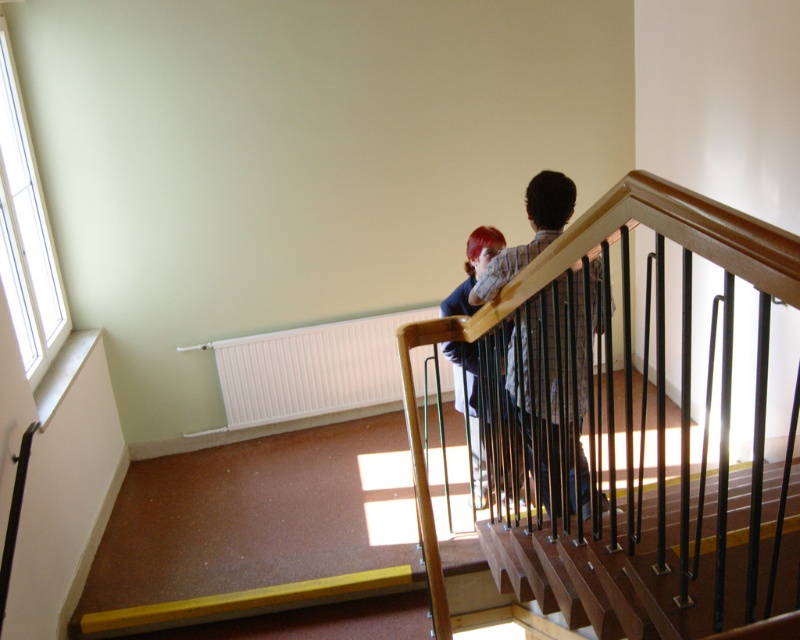
You are at the bottom of the staircase and want to reach the wooden handrail at upper center. There is a plaid shirt at upper center in your way. Can you still reach the handrail?

The wooden handrail at upper center is larger in size than the plaid shirt at upper center, so it is likely that the handrail extends beyond the plaid shirt, allowing you to reach it.